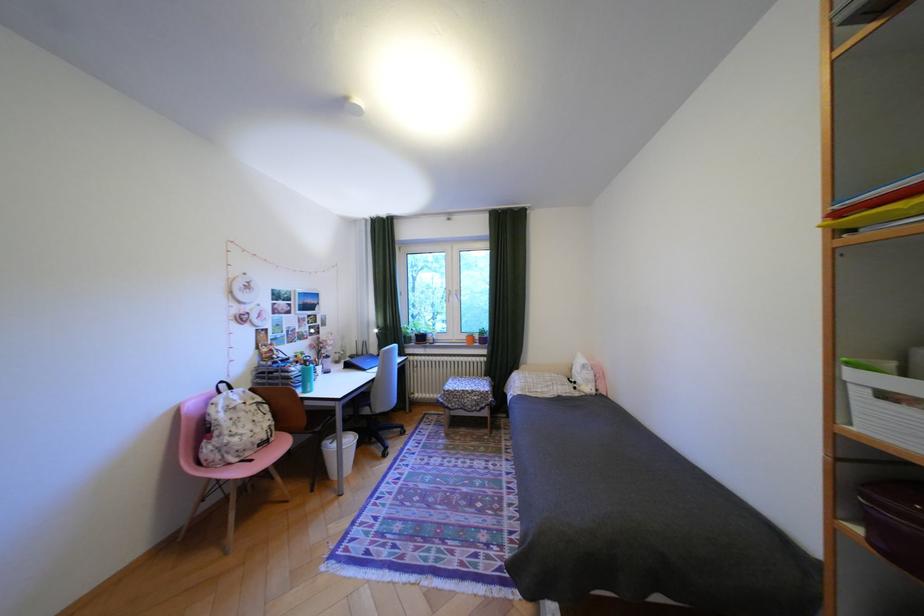
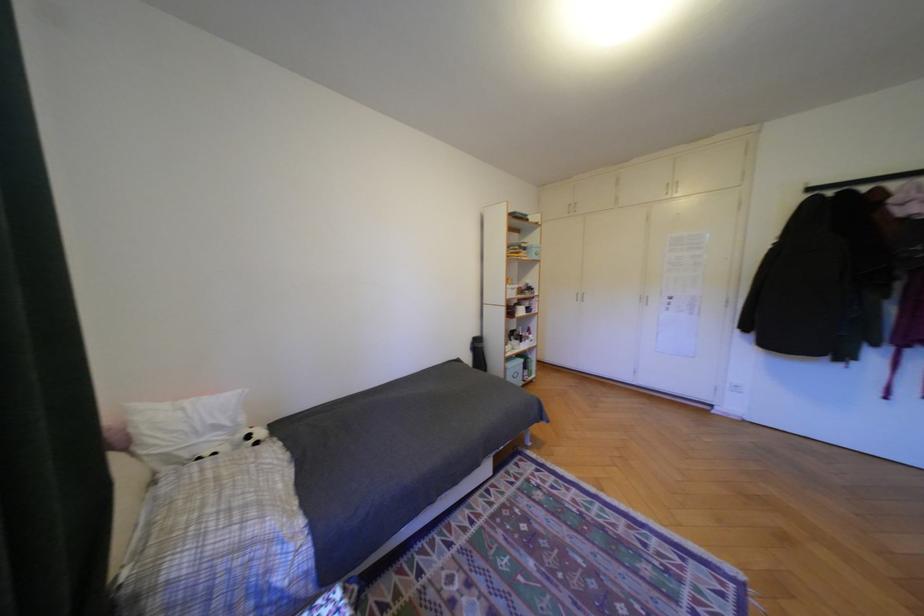
In the second image, find the point that corresponds to point (587, 383) in the first image.

(261, 437)